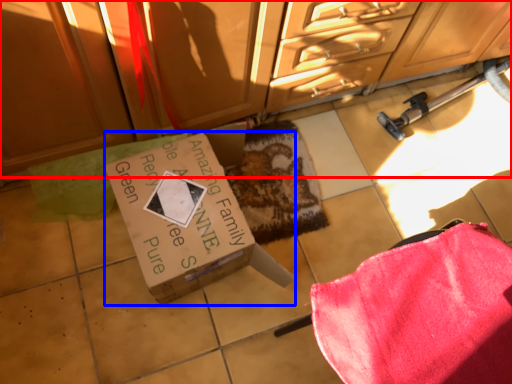
Question: Which point is closer to the camera, cabinetry (highlighted by a red box) or box (highlighted by a blue box)?

Choices:
 (A) cabinetry
 (B) box

Answer: (A)